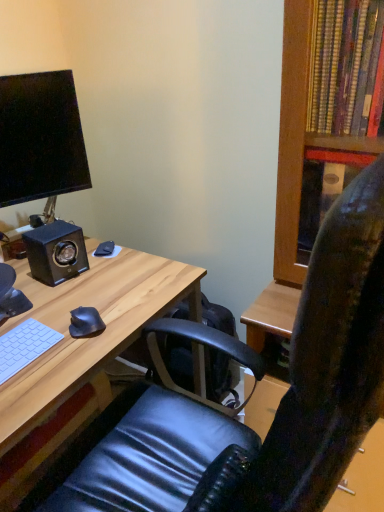
Find the location of a particular element. The width and height of the screenshot is (384, 512). free space in front of black matte mouse at lower left, which is counted as the 2th mouse, starting from the front is located at coordinates (100, 274).